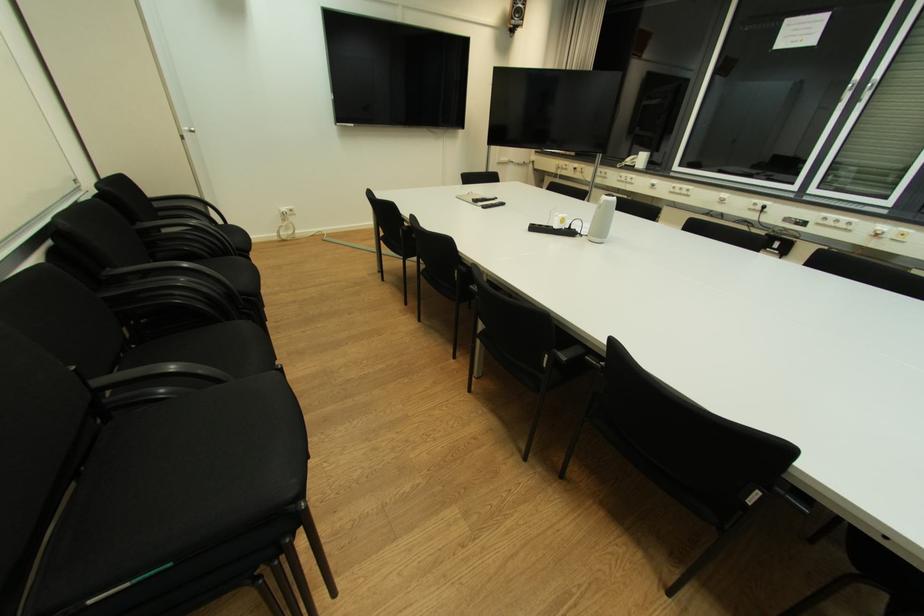
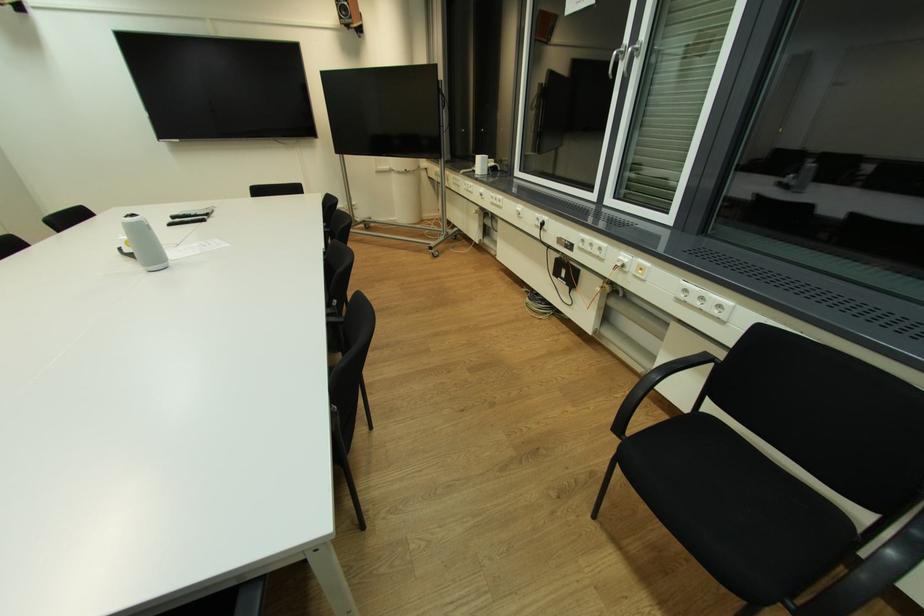
Question: Which direction would the cameraman need to move to produce the second image? Reply with the corresponding letter.

Choices:
 (A) Left
 (B) Right
 (C) Forward
 (D) Backward

Answer: (B)